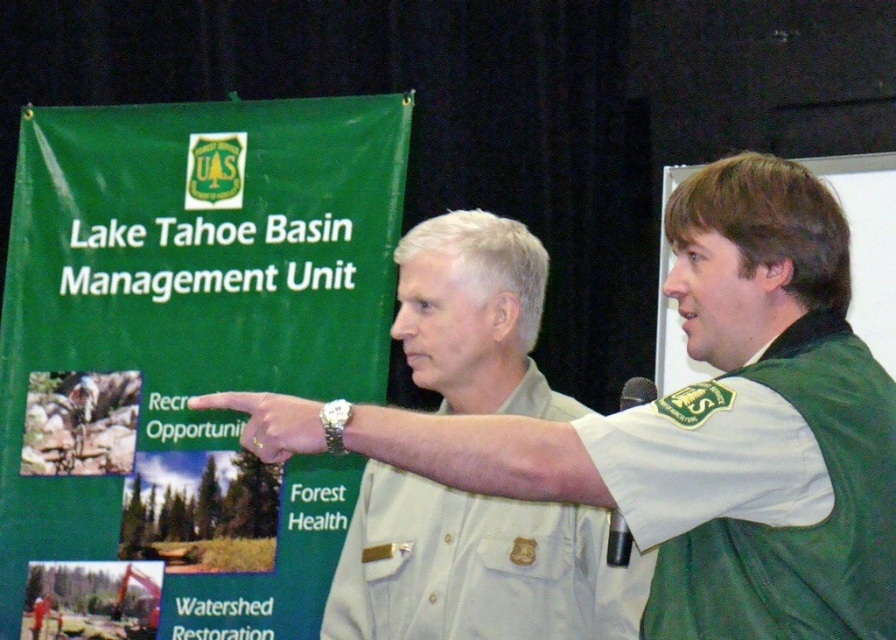
Question: Which of these objects is positioned farthest from the green fabric vest at right?

Choices:
 (A) green uniform at center
 (B) green fabric poster at left
 (C) silver metallic watch at upper center
 (D) white cotton shirt at center

Answer: (B)

Question: Is green fabric poster at left positioned in front of white cotton shirt at center?

Choices:
 (A) yes
 (B) no

Answer: (B)

Question: Which point is closer to the camera?

Choices:
 (A) (199, 563)
 (B) (434, 547)
 (C) (812, 172)

Answer: (B)

Question: Can you confirm if white cotton shirt at center is positioned below green fabric vest at right?

Choices:
 (A) yes
 (B) no

Answer: (A)

Question: Considering the real-world distances, which object is closest to the green uniform at center?

Choices:
 (A) silver metallic watch at upper center
 (B) white cotton shirt at center
 (C) green fabric vest at right
 (D) green fabric poster at left

Answer: (B)

Question: Can you confirm if white cotton shirt at center is bigger than green fabric vest at right?

Choices:
 (A) no
 (B) yes

Answer: (B)